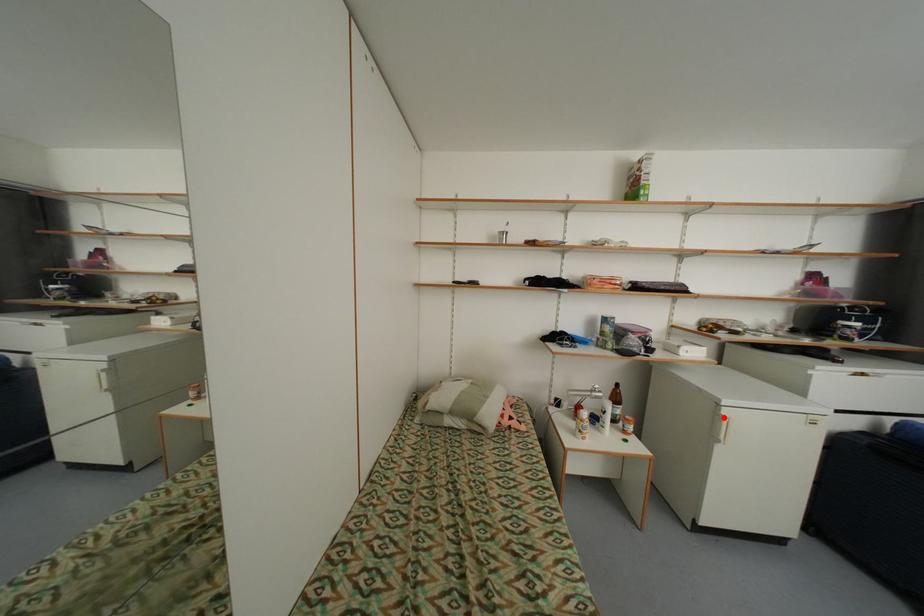
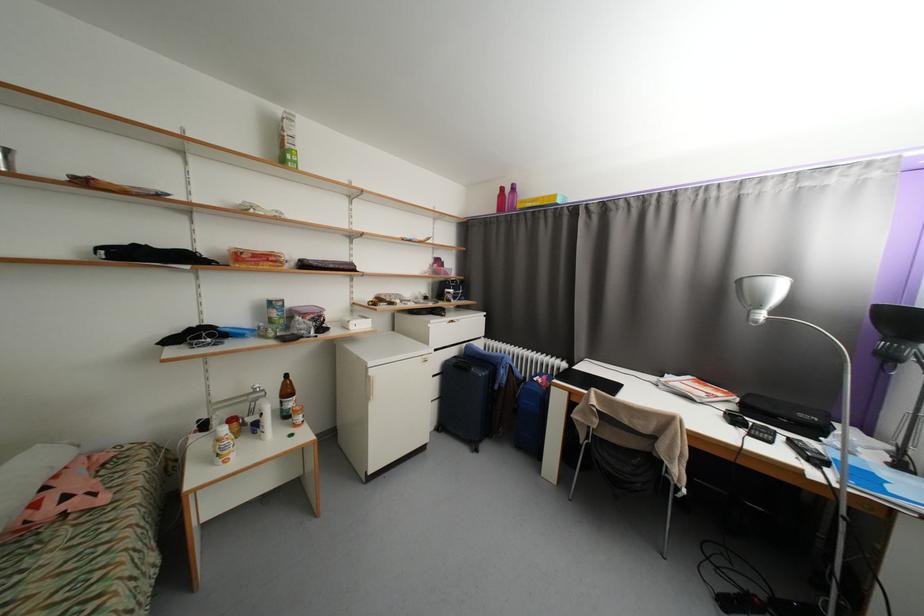
Locate, in the second image, the point that corresponds to the highlighted location in the first image.

(373, 379)